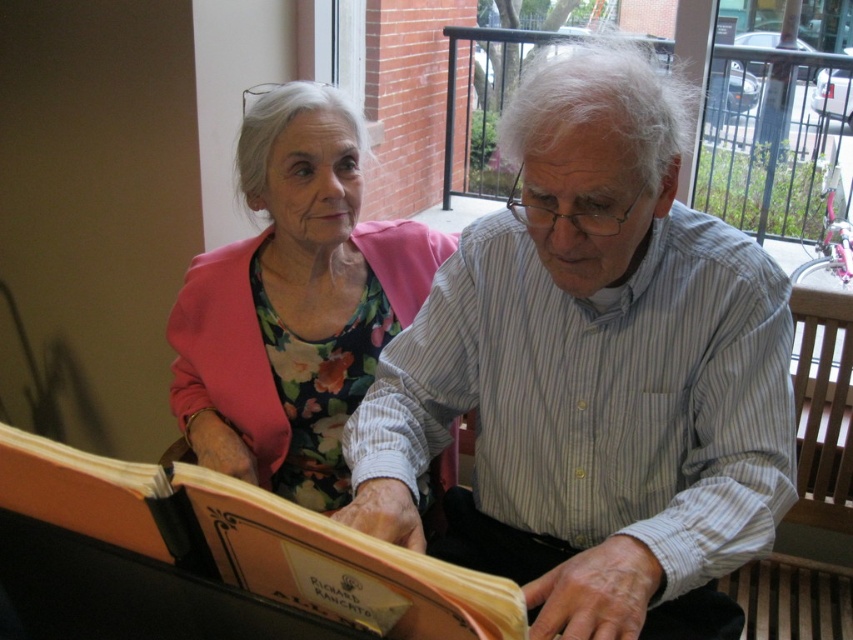
Question: Which point is closer to the camera?

Choices:
 (A) (277, 410)
 (B) (115, 522)
 (C) (695, 620)
 (D) (677, 300)

Answer: (B)

Question: Does white striped shirt at center come in front of orange paper book at center?

Choices:
 (A) no
 (B) yes

Answer: (A)

Question: Is white striped shirt at center further to the viewer compared to floral fabric dress at upper left?

Choices:
 (A) no
 (B) yes

Answer: (A)

Question: Which point is farther to the camera?

Choices:
 (A) (511, 220)
 (B) (463, 486)
 (C) (305, 605)

Answer: (B)

Question: Can you confirm if floral fabric dress at upper left is positioned to the left of smooth fabric lap at center?

Choices:
 (A) yes
 (B) no

Answer: (A)

Question: Which point is farther from the camera taking this photo?

Choices:
 (A) (238, 586)
 (B) (502, 568)
 (C) (331, 460)
 (D) (497, 548)

Answer: (C)